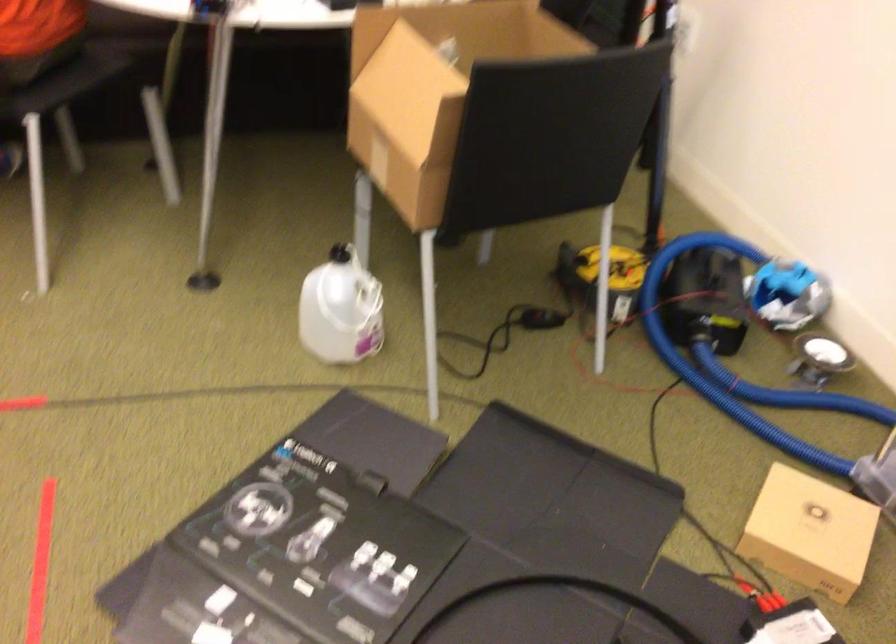
Image resolution: width=896 pixels, height=644 pixels. What are the coordinates of `plastic jug handle` in the screenshot? It's located at (367, 305).